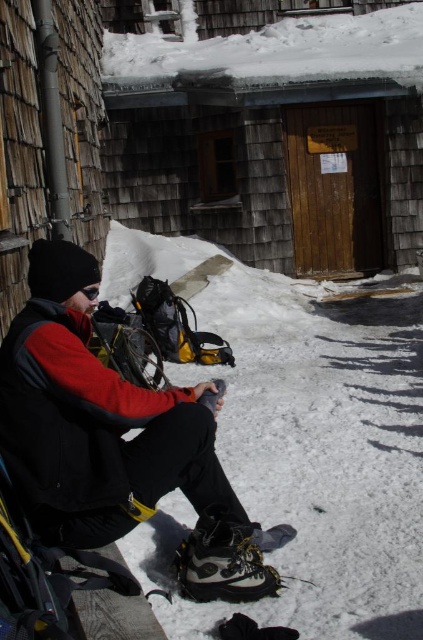
Question: Which point is farther to the camera?

Choices:
 (A) (412, 236)
 (B) (142, 516)
 (C) (239, 520)

Answer: (A)

Question: Is wooden cabin at center to the left of camouflage fabric ski boot at lower center from the viewer's perspective?

Choices:
 (A) yes
 (B) no

Answer: (B)

Question: Is wooden cabin at center wider than matte black jacket at center?

Choices:
 (A) yes
 (B) no

Answer: (B)

Question: Which of these objects is positioned farthest from the matte black jacket at center?

Choices:
 (A) wooden cabin at center
 (B) camouflage fabric ski boot at lower center

Answer: (A)

Question: Can you confirm if wooden cabin at center is wider than matte black jacket at center?

Choices:
 (A) no
 (B) yes

Answer: (A)

Question: Based on their relative distances, which object is nearer to the matte black jacket at center?

Choices:
 (A) camouflage fabric ski boot at lower center
 (B) wooden cabin at center

Answer: (A)